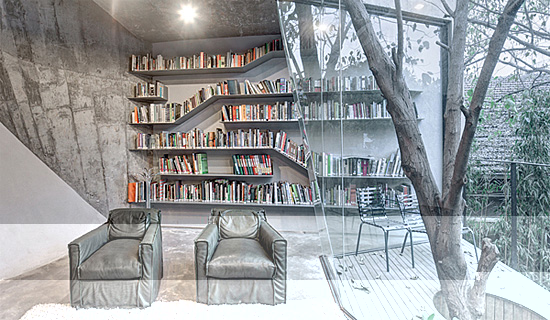
Where is `floor`? Image resolution: width=550 pixels, height=320 pixels. floor is located at coordinates (300, 297).